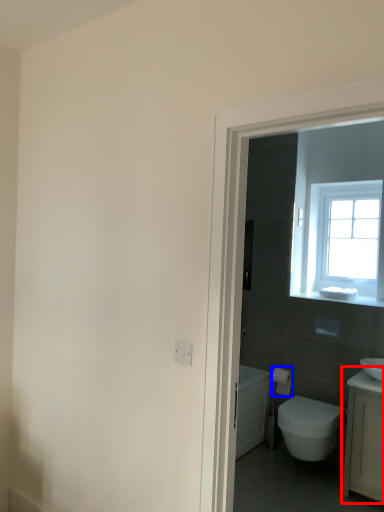
Question: Which point is further to the camera, counter top (highlighted by a red box) or toilet paper (highlighted by a blue box)?

Choices:
 (A) counter top
 (B) toilet paper

Answer: (B)